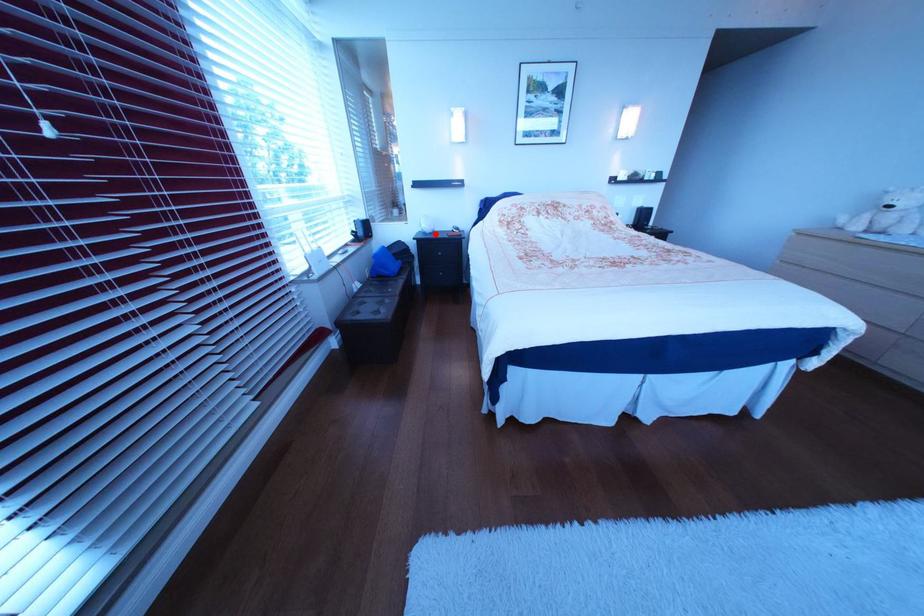
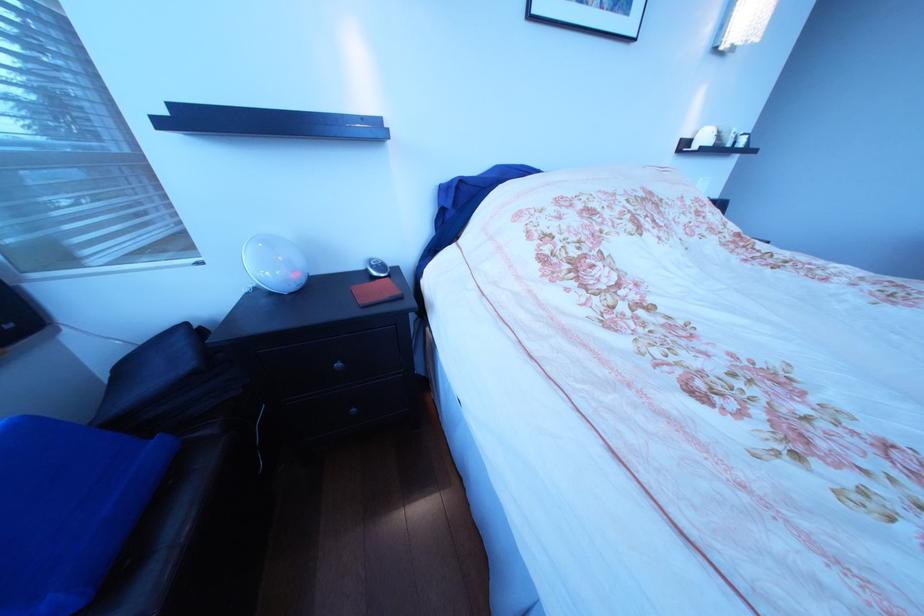
The point at the highlighted location is marked in the first image. Where is the corresponding point in the second image?

(272, 291)